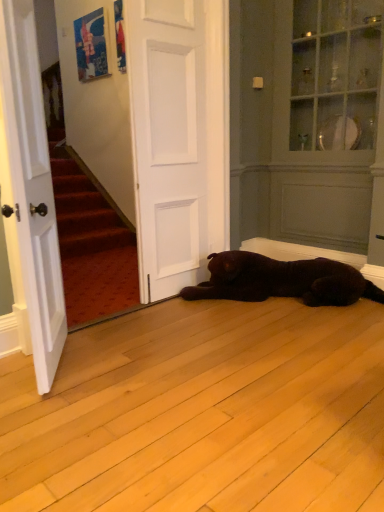
This screenshot has height=512, width=384. What are the coordinates of `free space to the back side of white wood door at left, the first door from the front` in the screenshot? It's located at (98, 335).